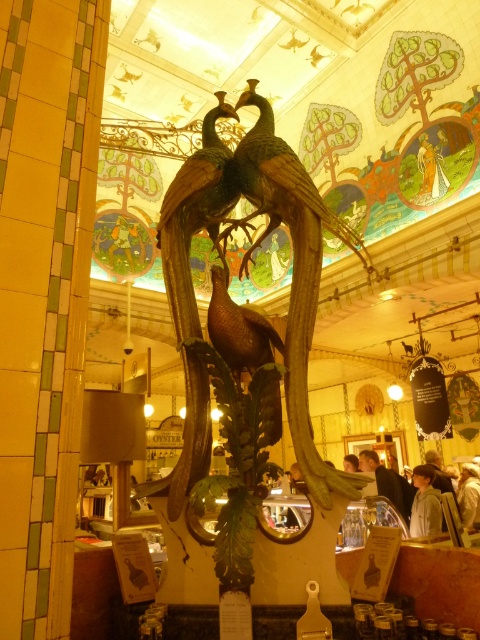
Question: Which point is farther from the camera taking this photo?

Choices:
 (A) (208, 157)
 (B) (269, 344)
 (C) (348, 230)

Answer: (C)

Question: Does wooden peacock at center have a lesser width compared to shiny metallic peacock at center?

Choices:
 (A) no
 (B) yes

Answer: (A)

Question: Is shiny metallic peacock at center above shiny bronze peacock at center?

Choices:
 (A) yes
 (B) no

Answer: (A)

Question: Where is wooden peacock at center located in relation to shiny metallic peacock at center in the image?

Choices:
 (A) left
 (B) right

Answer: (A)

Question: Which is farther from the shiny gold peacock at center?

Choices:
 (A) shiny bronze peacock at center
 (B) wooden peacock at center

Answer: (A)

Question: Which point is closer to the camera taking this photo?

Choices:
 (A) (227, 317)
 (B) (212, 579)
 (C) (229, 204)
 (D) (368, 273)

Answer: (B)